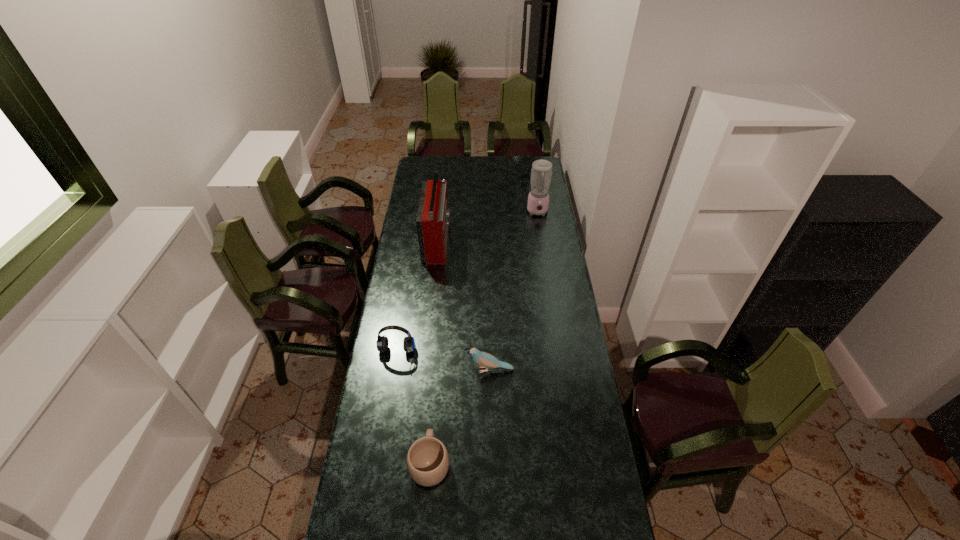
At what (x,y) coordinates should I click in order to perform the action: click on vacant space located at the face of the fourth object from left to right. Please return your answer as a coordinate pair (x, y). Looking at the image, I should click on (384, 370).

Find the location of `vacant space located at the face of the fourth object from left to right`. vacant space located at the face of the fourth object from left to right is located at coordinates (402, 370).

At what (x,y) coordinates should I click in order to perform the action: click on free space located 0.280m on the side of the shortest object with the handle. Please return your answer as a coordinate pair (x, y). Looking at the image, I should click on (437, 369).

The height and width of the screenshot is (540, 960). Identify the location of vacant area situated 0.050m on the side of the shortest object with the handle. (433, 424).

Locate an element on the screen. The image size is (960, 540). vacant region located on the side of the shortest object with the handle is located at coordinates (439, 347).

Locate an element on the screen. The height and width of the screenshot is (540, 960). radio receiver at the left edge is located at coordinates (432, 221).

The image size is (960, 540). I want to click on headset present at the left edge, so (382, 343).

At what (x,y) coordinates should I click in order to perform the action: click on object situated at the right edge. Please return your answer as a coordinate pair (x, y). This screenshot has width=960, height=540. Looking at the image, I should click on (538, 199).

Where is `free space at the far edge of the desktop`? free space at the far edge of the desktop is located at coordinates (460, 170).

In order to click on vacant space at the left edge of the desktop in this screenshot , I will do `click(395, 405)`.